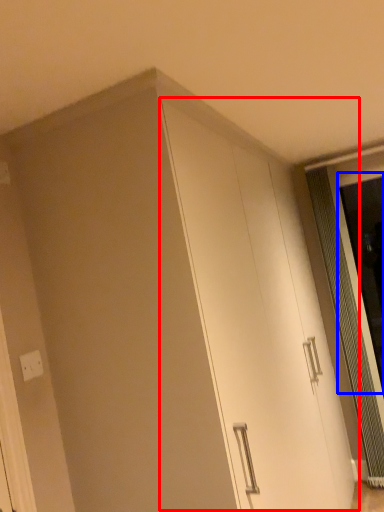
Question: Among these objects, which one is nearest to the camera, cabinetry (highlighted by a red box) or screen door (highlighted by a blue box)?

Choices:
 (A) cabinetry
 (B) screen door

Answer: (A)